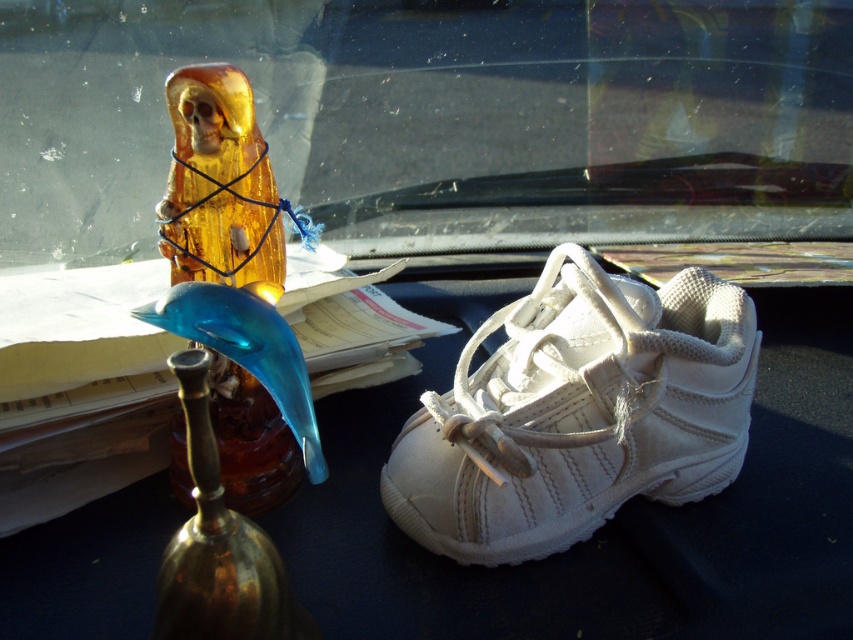
Where is the white suede running shoe at center located in the coordinate system?

The white suede running shoe at center is located at point (578, 413).

You are a passenger in the car and want to reach the transparent glass windshield at upper center from your current position. Can you comfortably extend your arm to touch it?

The transparent glass windshield at upper center is 1.21 meters away from the viewer, so yes, you can comfortably extend your arm to touch it as the distance is within typical arm reach.